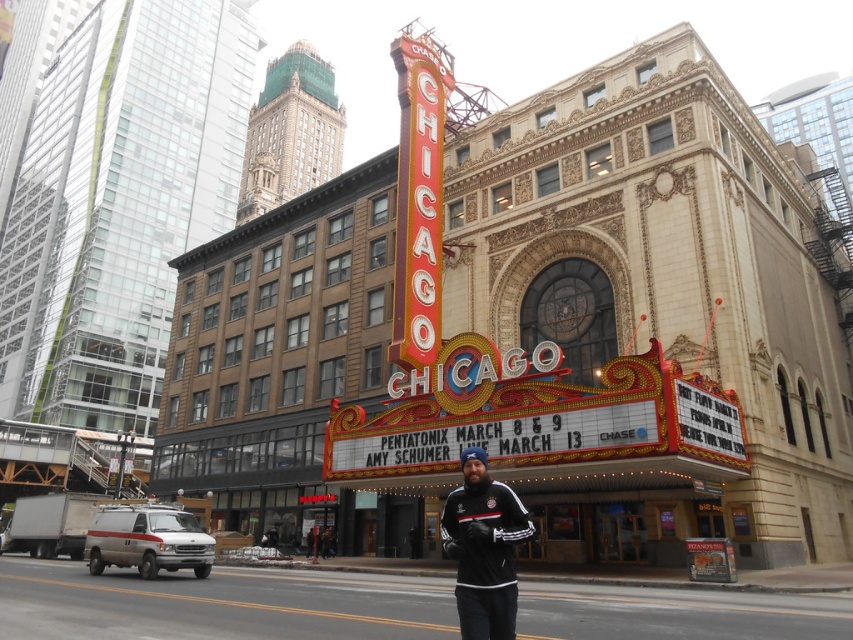
Is point (209, 371) positioned in front of point (479, 550)?

No, (209, 371) is behind (479, 550).

Is marble theater at center in front of black fleece jacket at center?

No, it is not.

Which is behind, point (827, 253) or point (482, 577)?

The point (827, 253) is behind.

Find the location of `marble theater at center`. marble theater at center is located at coordinates (662, 292).